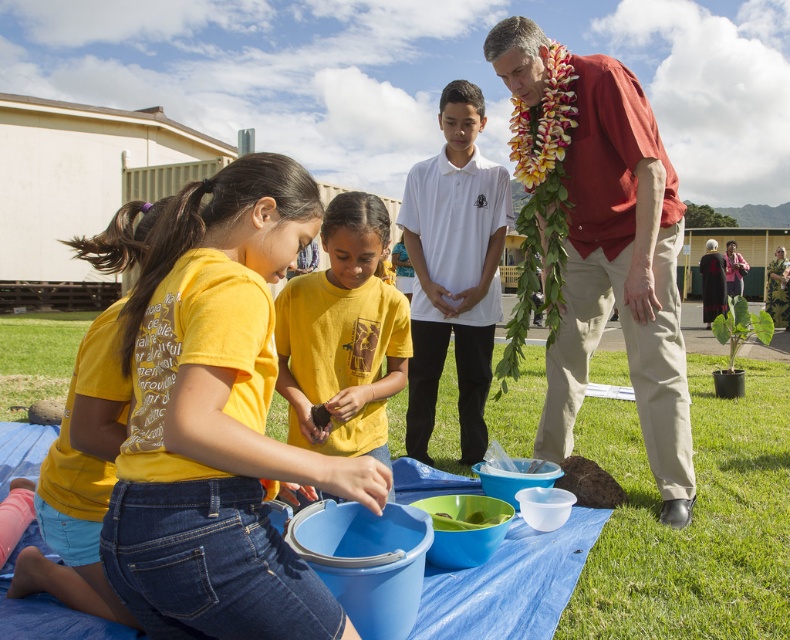
You are a photographer trying to capture a wide shot of the scene. The red cotton shirt at upper right and the green leafy plant at lower left are both in your frame. Which object will appear narrower in the photo?

The red cotton shirt at upper right will appear narrower in the photo because it has a lesser width compared to the green leafy plant at lower left.

Consider the image. You are a photographer trying to capture a photo of the green leafy plant at lower right without including the yellow matte shirt at center in the frame. Based on their positions, is this possible?

The yellow matte shirt at center is below the green leafy plant at lower right, so the shirt is positioned lower than the plant. Since the shirt is below the plant, adjusting the camera angle to focus on the plant at lower right while angling upwards might exclude the shirt from the frame.

You are a photographer trying to capture both the yellow matte shirt at center and the yellow cotton shirt at lower left in a single shot. Which shirt should you focus on first to ensure both are in focus?

You should focus on the yellow matte shirt at center first since it is closer to you than the yellow cotton shirt at lower left, ensuring both will be in focus when using depth of field properly.